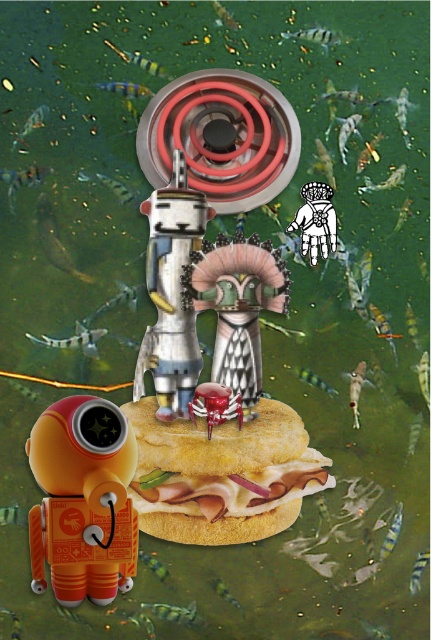
In the scene shown: Is orange matte robot at lower left to the right of metallic silver robot at center from the viewer's perspective?

Incorrect, orange matte robot at lower left is not on the right side of metallic silver robot at center.

Looking at this image, which is below, orange matte robot at lower left or metallic silver robot at center?

orange matte robot at lower left is below.

Which is behind, point (72, 465) or point (183, 163)?

The point (183, 163) is more distant.

Locate an element on the screen. This screenshot has height=640, width=431. orange matte robot at lower left is located at coordinates (83, 500).

Does golden crispy bun at center appear under orange matte robot at lower left?

No.

Is golden crispy bun at center to the right of orange matte robot at lower left from the viewer's perspective?

Indeed, golden crispy bun at center is positioned on the right side of orange matte robot at lower left.

Does point (197, 452) come behind point (62, 449)?

Yes, it is.

This screenshot has height=640, width=431. Find the location of `golden crispy bun at center`. golden crispy bun at center is located at coordinates (222, 474).

Between metallic silver robot at center and white paper hand at upper center, which one has more height?

Standing taller between the two is metallic silver robot at center.

Who is higher up, metallic silver robot at center or white paper hand at upper center?

white paper hand at upper center is higher up.

Find the location of `metallic silver robot at center`. metallic silver robot at center is located at coordinates pos(171,292).

This screenshot has width=431, height=640. Identify the location of metallic silver robot at center. (171, 292).